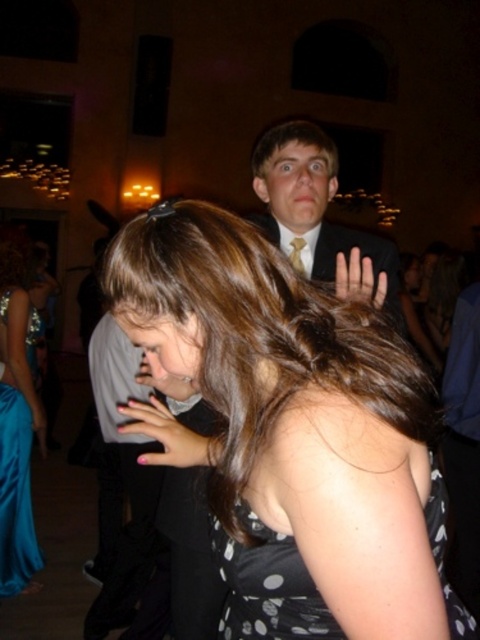
You are standing at the center of the dance floor and see the point marked as point (16, 419). If you want to move towards the direction of that point, which direction should you walk?

The point (16, 419) is located at the lower left, so you should walk towards the lower left direction.

You are a photographer at the event and want to capture a closeup shot of both the matte skin hand at upper center and the matte black hand at lower center in the same frame. Given their distance, is this possible without moving the camera?

The matte skin hand at upper center is 18.26 inches away from the matte black hand at lower center. Since this distance is within the camera lens focus range, the photographer can capture both hands in the same frame without moving the camera.